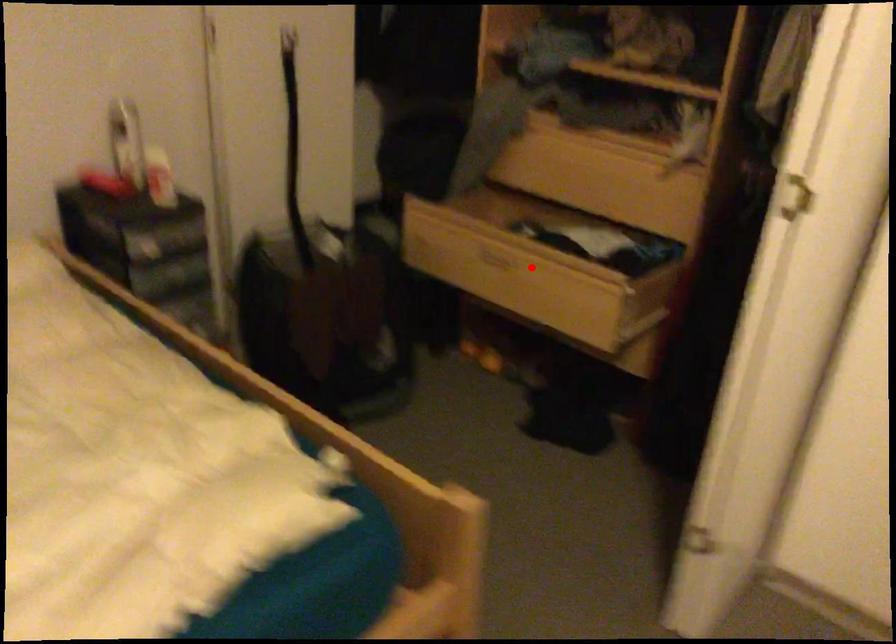
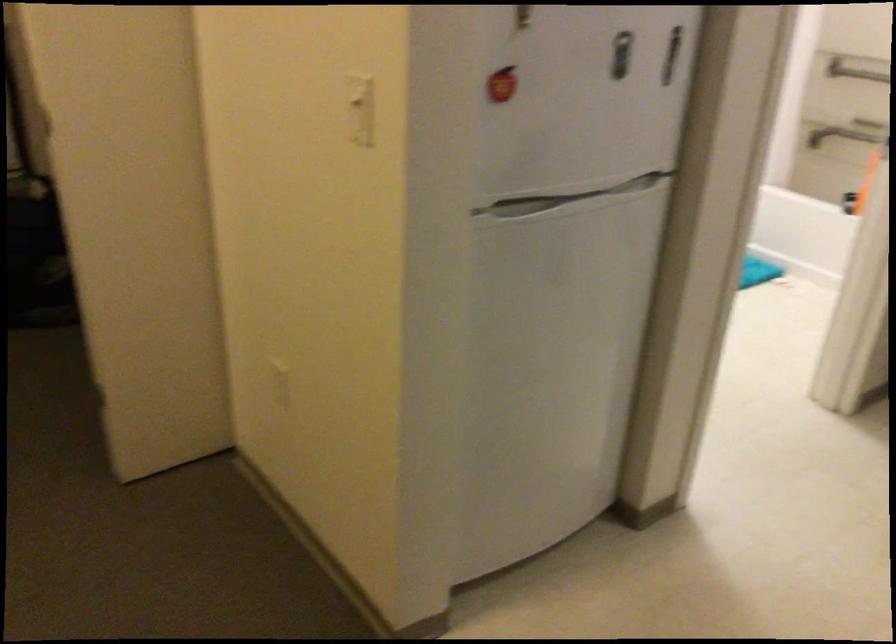
Question: I am providing you with two images of the same scene from different viewpoints. A red point is marked on the first image. Is the red point's position out of view in image 2?

Choices:
 (A) Yes
 (B) No

Answer: (A)